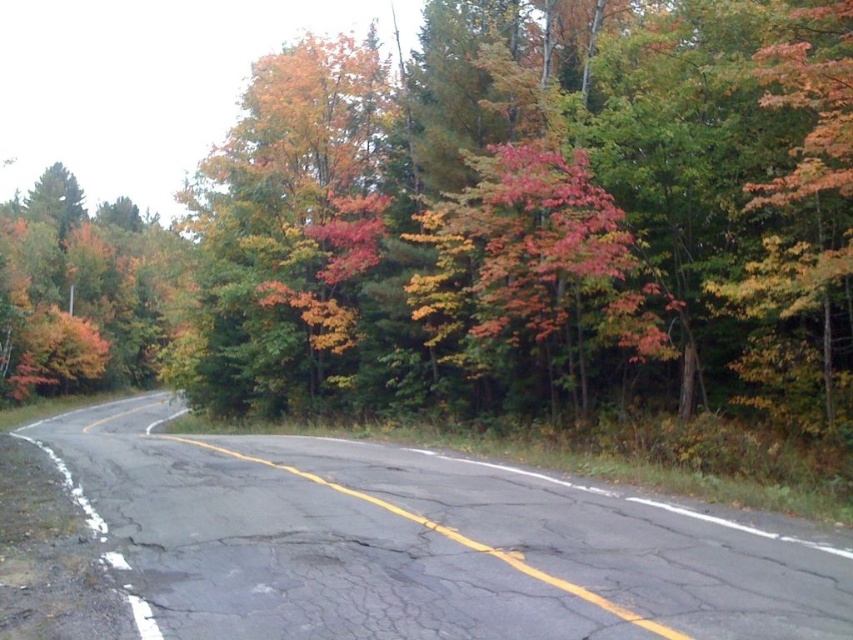
You are a hiker standing at the point marked by the coordinates [485,230]. Based on the scene description, what can you see around you?

You can see autumn foliage at center around you, as the point [485,230] indicates autumn foliage at center.